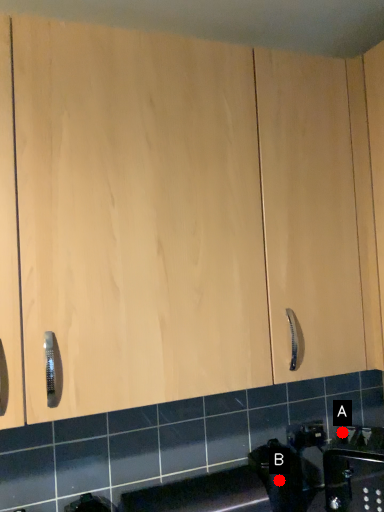
Question: Two points are circled on the image, labeled by A and B beside each circle. Among these points, which one is farthest from the camera?

Choices:
 (A) A is further
 (B) B is further

Answer: (A)